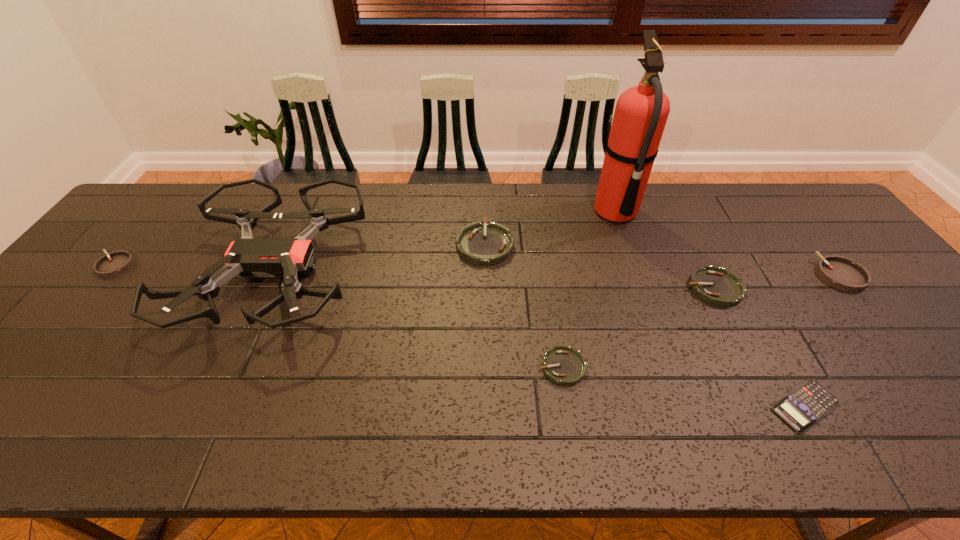
Where is `vacant space that satisfies the following two spatial constraints: 1. at the nozzle of the blue calculator; 2. on the left side of the red fire extinguisher`? The height and width of the screenshot is (540, 960). vacant space that satisfies the following two spatial constraints: 1. at the nozzle of the blue calculator; 2. on the left side of the red fire extinguisher is located at coordinates (684, 407).

Find the location of a particular element. Image resolution: width=960 pixels, height=540 pixels. vacant region that satisfies the following two spatial constraints: 1. on the back side of the rightmost object; 2. on the left side of the second shortest object is located at coordinates (548, 275).